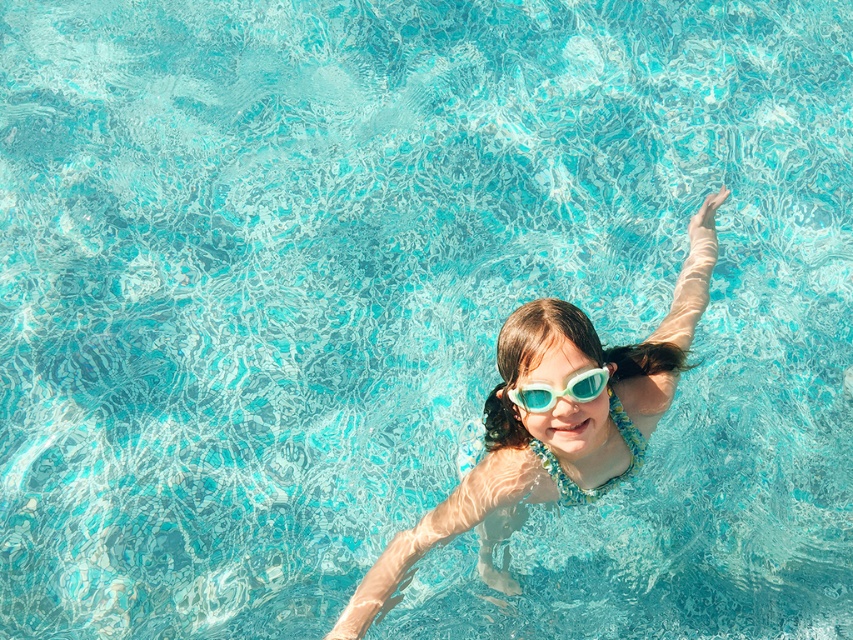
This screenshot has width=853, height=640. Describe the element at coordinates (553, 424) in the screenshot. I see `translucent plastic goggles at center` at that location.

Does translucent plastic goggles at center have a lesser width compared to clear plastic goggles at center?

No.

Is point (663, 358) behind point (538, 400)?

Yes, point (663, 358) is farther from viewer.

Locate an element on the screen. The height and width of the screenshot is (640, 853). translucent plastic goggles at center is located at coordinates (553, 424).